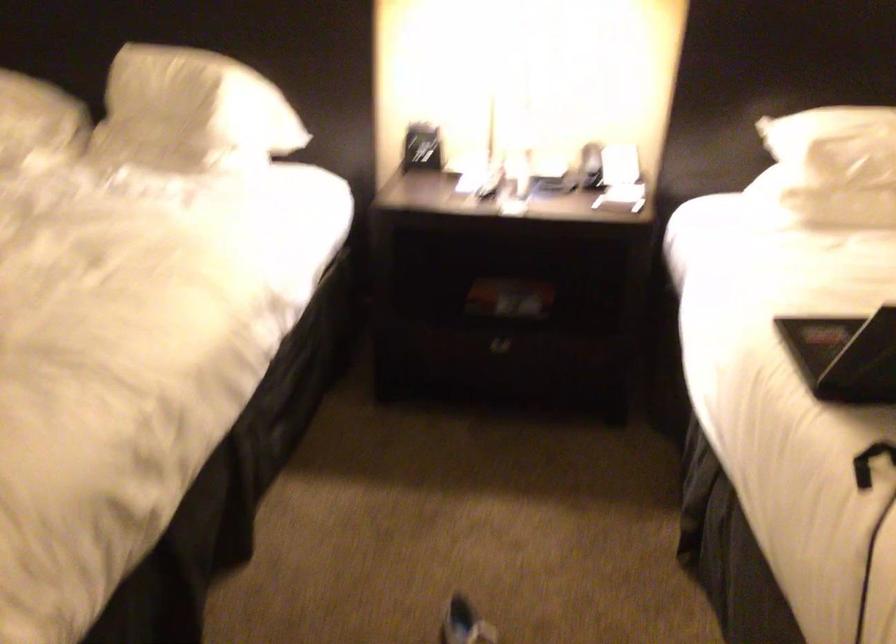
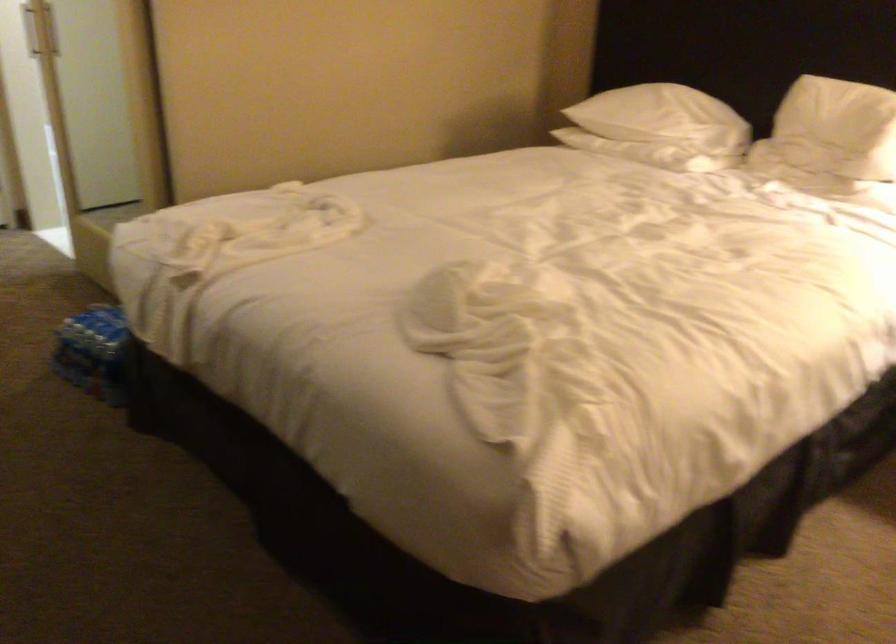
Locate, in the second image, the point that corresponds to pixel 176 109 in the first image.

(837, 128)